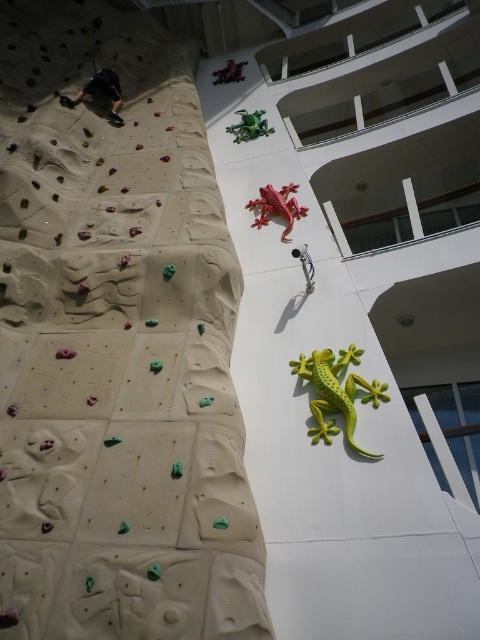
Question: Is green matte lizard at center-right to the right of rubberized red lizard at center from the viewer's perspective?

Choices:
 (A) no
 (B) yes

Answer: (B)

Question: Which point appears farthest from the camera in this image?

Choices:
 (A) (262, 221)
 (B) (374, 403)

Answer: (A)

Question: Can you confirm if green matte lizard at center-right is bigger than rubberized red lizard at center?

Choices:
 (A) yes
 (B) no

Answer: (A)

Question: Is green matte lizard at center-right to the left of rubberized red lizard at center from the viewer's perspective?

Choices:
 (A) yes
 (B) no

Answer: (B)

Question: Which point is closer to the camera?

Choices:
 (A) rubberized red lizard at center
 (B) green matte lizard at center-right

Answer: (B)